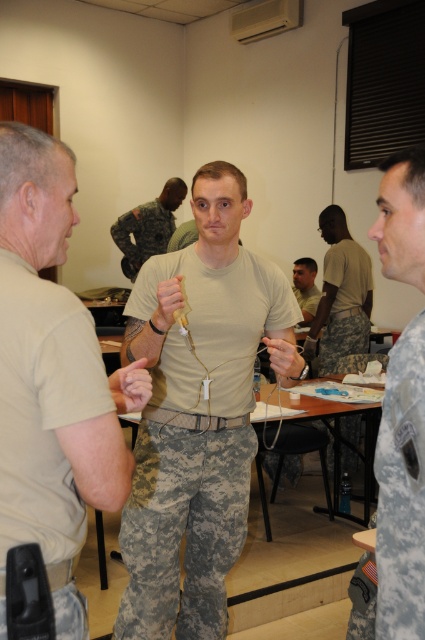
You are a photographer positioned at the back of the room. You need to take a photo of the camouflage fabric uniform at center and the tan uniform at center. Which one will appear larger in the photo?

The camouflage fabric uniform at center will appear larger in the photo because it is closer to the viewer than the tan uniform at center.

From the picture: You are a photographer standing at the point with coordinates (402,490) in the image. What object is located exactly at your current position?

The camouflage fabric uniform at center is located exactly at the point with coordinates (402,490).

You are standing in the room and need to locate the tan matte uniform at center. According to the coordinates given, where should you look?

The tan matte uniform at center is located at the coordinates point (198,413).